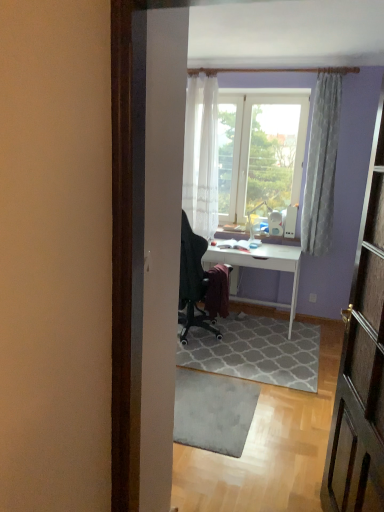
Question: Relative to transparent glass window at center, is white glossy desk at center in front or behind?

Choices:
 (A) behind
 (B) front

Answer: (B)

Question: From a real-world perspective, is white glossy desk at center above or below transparent glass window at center?

Choices:
 (A) above
 (B) below

Answer: (B)

Question: Which object is positioned farthest from the transparent glass window at center?

Choices:
 (A) white textured curtain at upper right, the first curtain positioned from the right
 (B) gray textured rug at center, positioned as the 1th doormat in back-to-front order
 (C) white sheer curtain at upper center, which appears as the 1th curtain when viewed from the left
 (D) white glossy desk at center
 (E) gray textured rug at center, which is the 2th doormat from back to front

Answer: (E)

Question: Which object is positioned closest to the white textured curtain at upper right, the first curtain positioned from the right?

Choices:
 (A) white glossy desk at center
 (B) gray textured rug at center, marked as the first doormat in a front-to-back arrangement
 (C) white sheer curtain at upper center, which appears as the 1th curtain when viewed from the left
 (D) transparent glass window at center
 (E) gray textured rug at center, positioned as the 1th doormat in back-to-front order

Answer: (D)